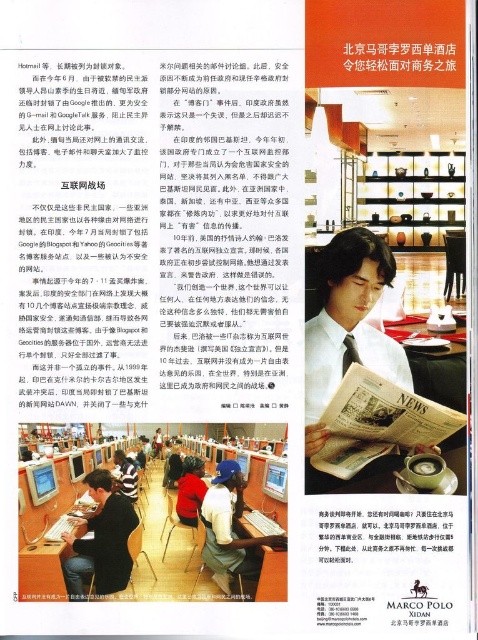
Is matte black computer at lower left thinner than red sweater at center?

Incorrect, matte black computer at lower left's width is not less than red sweater at center's.

This screenshot has height=640, width=478. What do you see at coordinates (165, 552) in the screenshot?
I see `matte black computer at lower left` at bounding box center [165, 552].

This screenshot has width=478, height=640. Identify the location of matte black computer at lower left. (165, 552).

Does point (415, 189) come behind point (180, 509)?

Yes, it is behind point (180, 509).

Who is more distant from viewer, (x=442, y=234) or (x=182, y=522)?

Positioned behind is point (x=442, y=234).

Which is behind, point (391, 186) or point (195, 516)?

Positioned behind is point (391, 186).

Where is `wooden shelves at center`? The width and height of the screenshot is (478, 640). wooden shelves at center is located at coordinates (412, 195).

Which is in front, point (327, 294) or point (231, 540)?

Positioned in front is point (231, 540).

Can you confirm if matte black hair at center is taller than matte black laptop at center?

Indeed, matte black hair at center has a greater height compared to matte black laptop at center.

What do you see at coordinates (347, 342) in the screenshot?
I see `matte black hair at center` at bounding box center [347, 342].

The width and height of the screenshot is (478, 640). What are the coordinates of `matte black hair at center` in the screenshot? It's located at (347, 342).